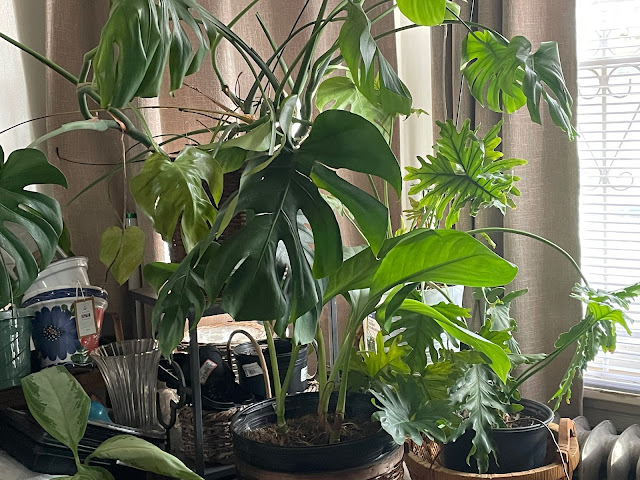
At what (x,y) coordinates should I click in order to perform the action: click on radiator. Please return your answer as a coordinate pair (x, y). Looking at the image, I should click on (595, 451).